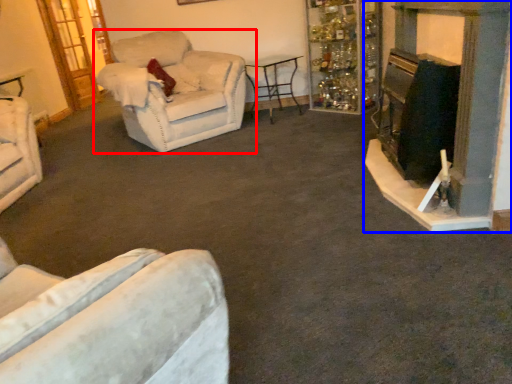
Question: Which object appears farthest to the camera in this image, chair (highlighted by a red box) or fireplace (highlighted by a blue box)?

Choices:
 (A) chair
 (B) fireplace

Answer: (A)